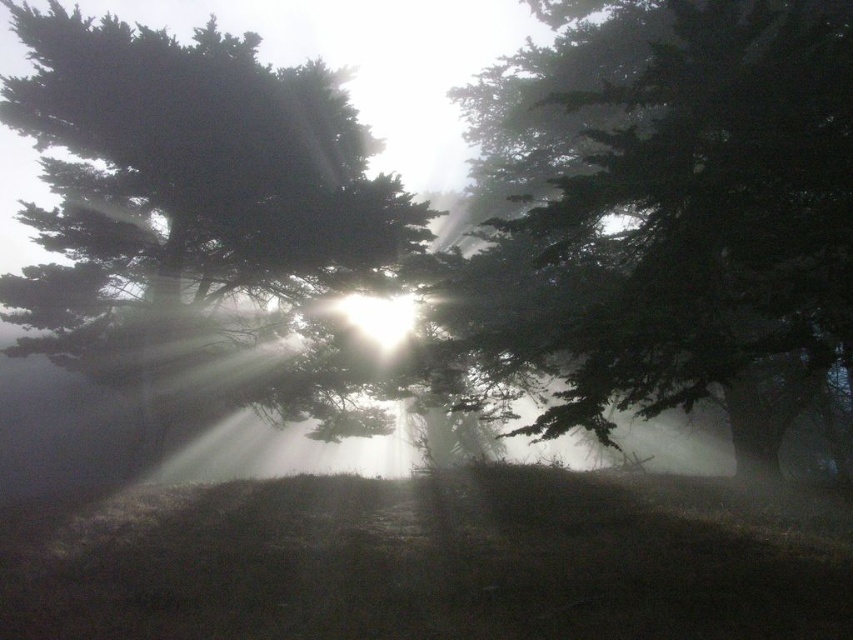
This screenshot has height=640, width=853. I want to click on green matte tree at center, so click(x=693, y=225).

Between green matte tree at center and green matte tree at upper left, which one appears on the left side from the viewer's perspective?

Positioned to the left is green matte tree at upper left.

Is point (747, 275) positioned after point (169, 275)?

No, (747, 275) is in front of (169, 275).

At what (x,y) coordinates should I click in order to perform the action: click on green matte tree at center. Please return your answer as a coordinate pair (x, y). Looking at the image, I should click on (693, 225).

Does green matte tree at center have a lesser width compared to bright white light at center?

In fact, green matte tree at center might be wider than bright white light at center.

What do you see at coordinates (693, 225) in the screenshot? This screenshot has width=853, height=640. I see `green matte tree at center` at bounding box center [693, 225].

Where is `green matte tree at center`? green matte tree at center is located at coordinates (693, 225).

Find the location of `green matte tree at center`. green matte tree at center is located at coordinates (693, 225).

Can you confirm if green matte tree at upper left is positioned to the left of bright white light at center?

Yes, green matte tree at upper left is to the left of bright white light at center.

Which is in front, point (247, 104) or point (410, 321)?

Point (247, 104)

The width and height of the screenshot is (853, 640). I want to click on green matte tree at upper left, so click(192, 172).